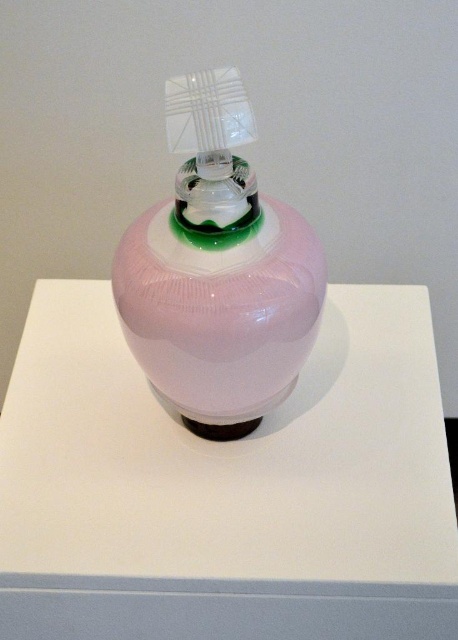
You are setting up a display and need to place both the glossy white table at center and the pink glossy bottle at center. Given their sizes, which object should you place first to ensure stability?

The glossy white table at center is larger in size than the pink glossy bottle at center, so you should place the glossy white table at center first to establish a stable base before placing the smaller bottle on top or beside it.

You are a delivery person who needs to place a small box on the glossy white table at center. The box is 10 cm tall. Can you safely place it there without it touching the pink glossy bottle at center?

The glossy white table at center is much taller than the pink glossy bottle at center, so placing a 10 cm tall box on the glossy white table at center would not interfere with the bottle as the table is significantly higher.